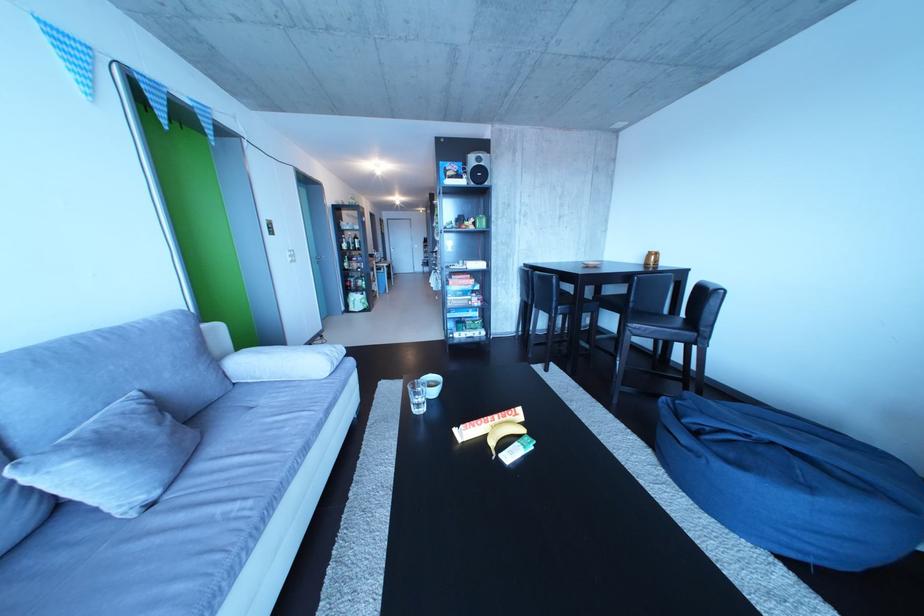
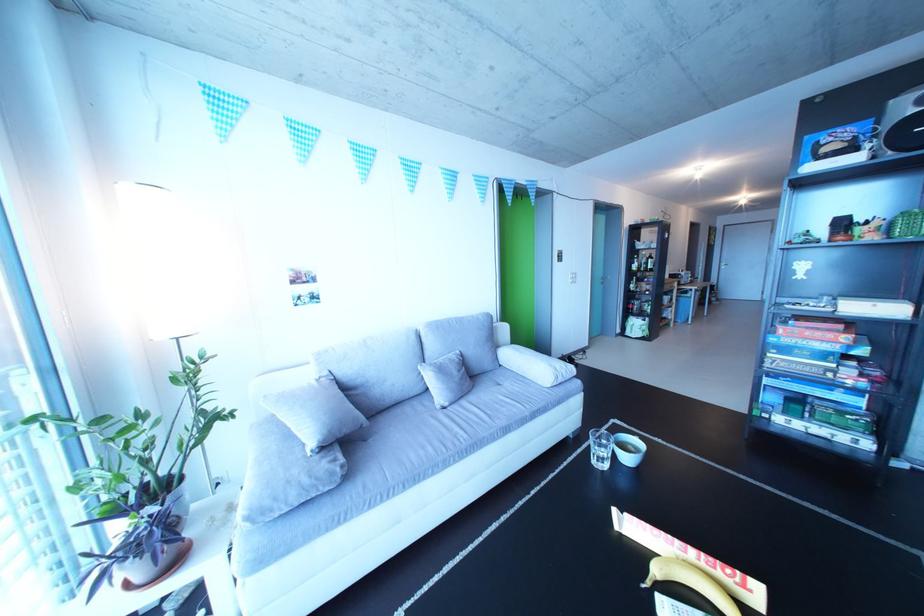
Where in the second image is the point corresponding to pixel 473 447 from the first image?

(630, 533)